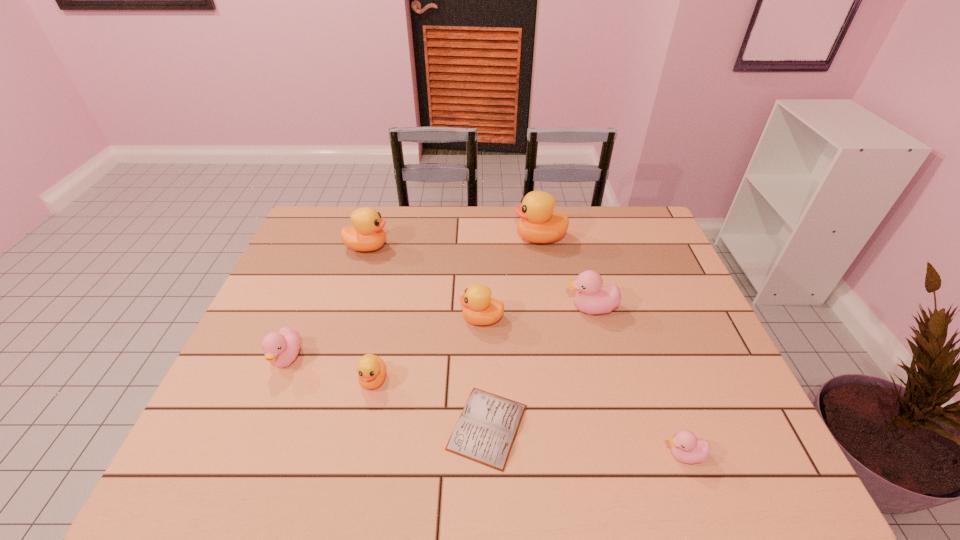
Locate an element on the screen. the third duckling from left to right is located at coordinates (371, 369).

Locate an element on the screen. Image resolution: width=960 pixels, height=540 pixels. the nearest duckling is located at coordinates (685, 446).

At what (x,y) coordinates should I click in order to perform the action: click on the smallest pink duckling. Please return your answer as a coordinate pair (x, y). Looking at the image, I should click on pos(685,446).

The height and width of the screenshot is (540, 960). In order to click on white diary in this screenshot , I will do `click(486, 430)`.

Locate an element on the screen. diary is located at coordinates (486, 430).

Where is `vacant space located 0.130m on the face of the rightmost yellow duckling`? vacant space located 0.130m on the face of the rightmost yellow duckling is located at coordinates (474, 238).

Where is `free spot located 0.060m on the face of the rightmost yellow duckling`? free spot located 0.060m on the face of the rightmost yellow duckling is located at coordinates (x=495, y=238).

Identify the location of free region located on the face of the rightmost yellow duckling. (413, 238).

This screenshot has height=540, width=960. Identify the location of vacant space situated on the face of the second object from left to right. (439, 247).

I want to click on vacant space located 0.160m on the front-facing side of the biggest pink duckling, so click(508, 308).